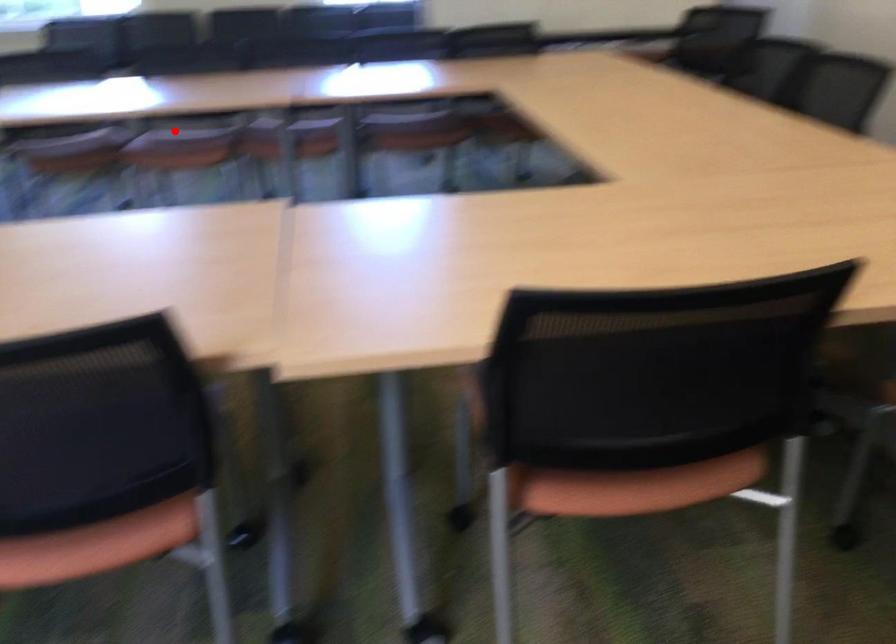
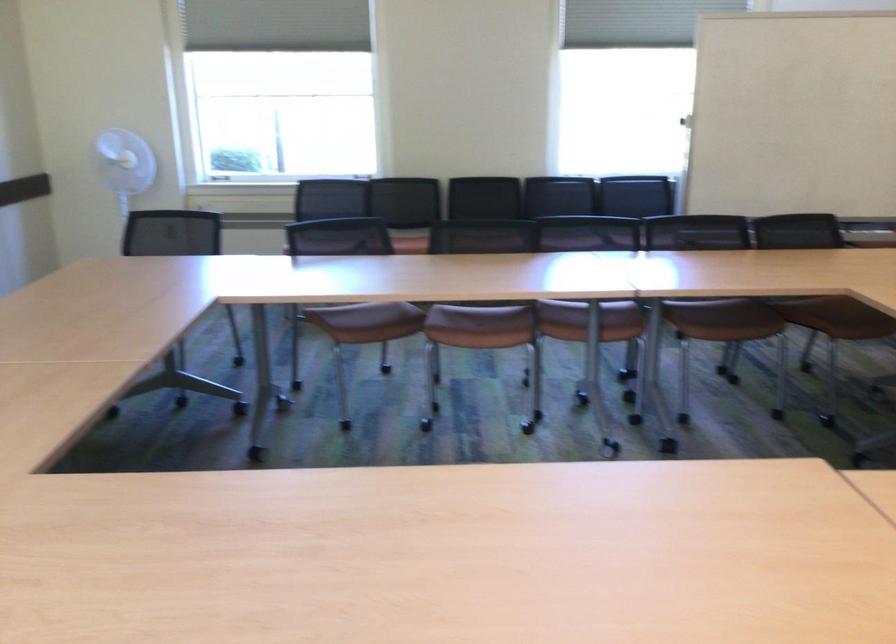
The point at the highlighted location is marked in the first image. Where is the corresponding point in the second image?

(483, 310)